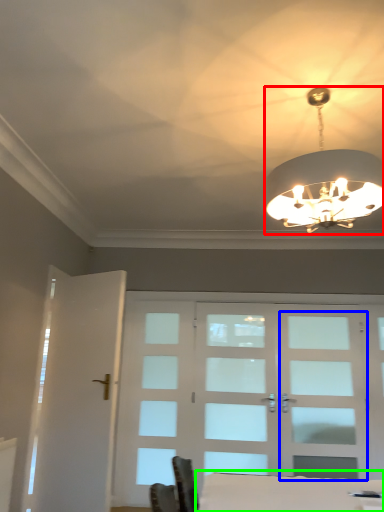
Question: Which object is the closest to the lamp (highlighted by a red box)? Choose among these: screen door (highlighted by a blue box) or table (highlighted by a green box).

Choices:
 (A) screen door
 (B) table

Answer: (B)